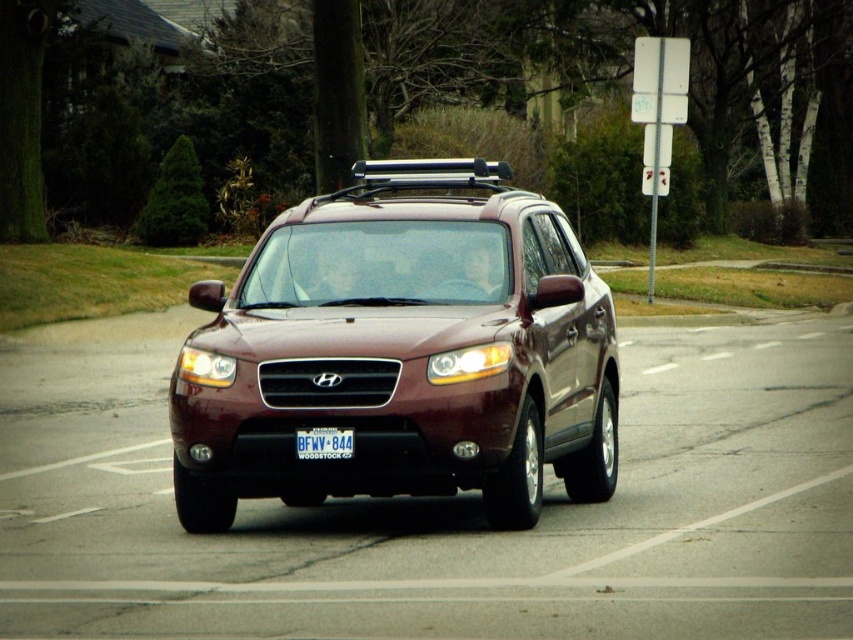
Which is in front, point (276, 323) or point (297, 452)?

Point (297, 452) is in front.

Does satin burgundy suv at center have a greater height compared to white plastic license plate at center?

Correct, satin burgundy suv at center is much taller as white plastic license plate at center.

Describe the element at coordinates (401, 353) in the screenshot. The image size is (853, 640). I see `satin burgundy suv at center` at that location.

Image resolution: width=853 pixels, height=640 pixels. I want to click on satin burgundy suv at center, so click(401, 353).